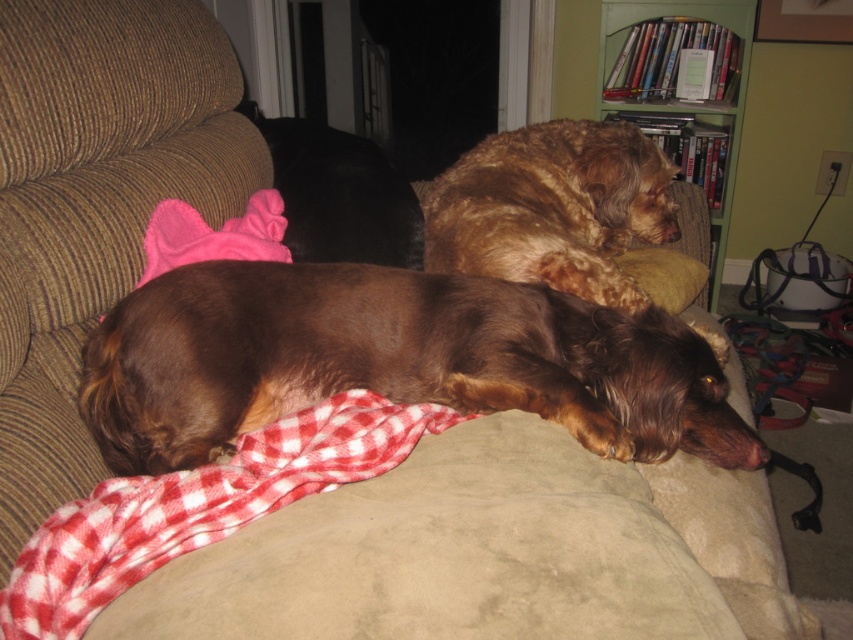
In the scene shown: Does brown shaggy dog at center have a smaller size compared to green wood bookshelf at upper right?

Yes.

Is brown shaggy dog at center behind green wood bookshelf at upper right?

No, brown shaggy dog at center is closer to the viewer.

Describe the element at coordinates (392, 362) in the screenshot. This screenshot has height=640, width=853. I see `brown shaggy dog at center` at that location.

Find the location of a particular element. brown shaggy dog at center is located at coordinates (392, 362).

Consider the image. Which is below, red checkered blanket at lower center or brown fuzzy dog at upper left?

red checkered blanket at lower center is below.

Does red checkered blanket at lower center appear under brown fuzzy dog at upper left?

Yes.

Does point (163, 497) come behind point (354, 208)?

No, it is in front of (354, 208).

You are a GUI agent. You are given a task and a screenshot of the screen. Output one action in this format:
    pyautogui.click(x=<x>, y=<y>)
    Task: Click on the red checkered blanket at lower center
    This screenshot has width=853, height=640.
    Given the screenshot: What is the action you would take?
    click(x=198, y=508)

From the picture: Can you confirm if red checkered blanket at lower center is wider than golden brown fur at upper right?

No, red checkered blanket at lower center is not wider than golden brown fur at upper right.

The image size is (853, 640). Describe the element at coordinates (198, 508) in the screenshot. I see `red checkered blanket at lower center` at that location.

At what (x,y) coordinates should I click in order to perform the action: click on red checkered blanket at lower center. Please return your answer as a coordinate pair (x, y). Looking at the image, I should click on (198, 508).